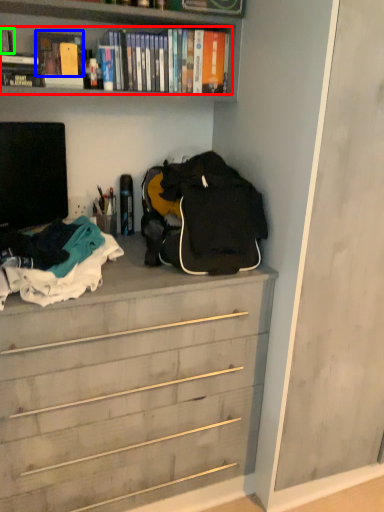
Question: Considering the real-world distances, which object is farthest from book (highlighted by a red box)? book (highlighted by a blue box) or book (highlighted by a green box)?

Choices:
 (A) book
 (B) book

Answer: (B)